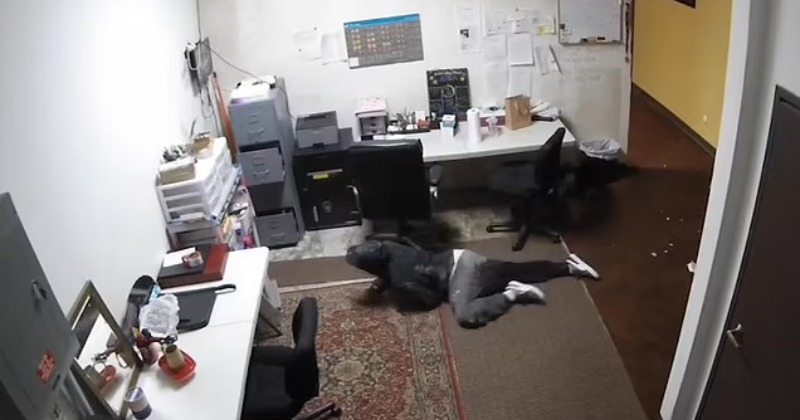
At what (x,y) coordinates should I click in order to perform the action: click on file cabinet. Please return your answer as a coordinate pair (x, y). Looking at the image, I should click on (266, 124).